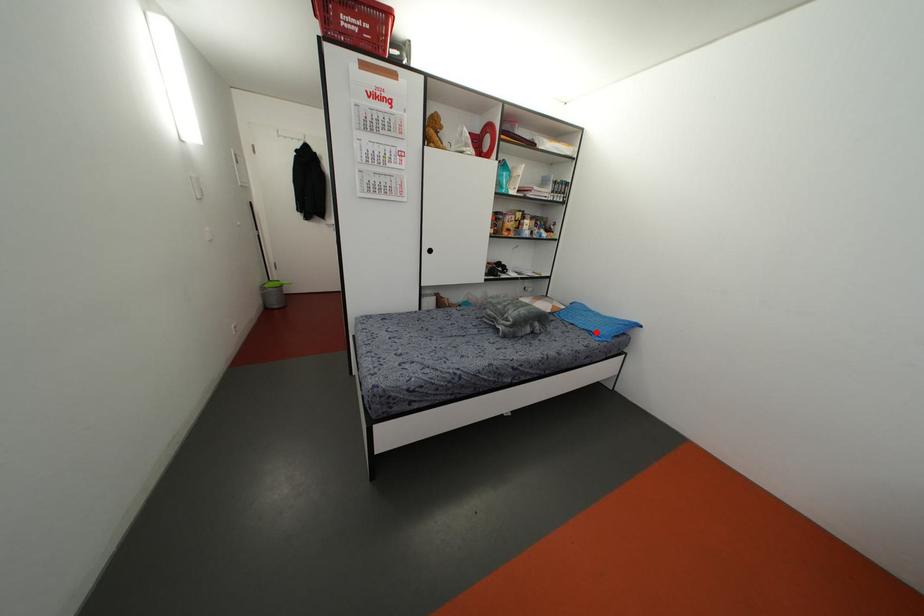
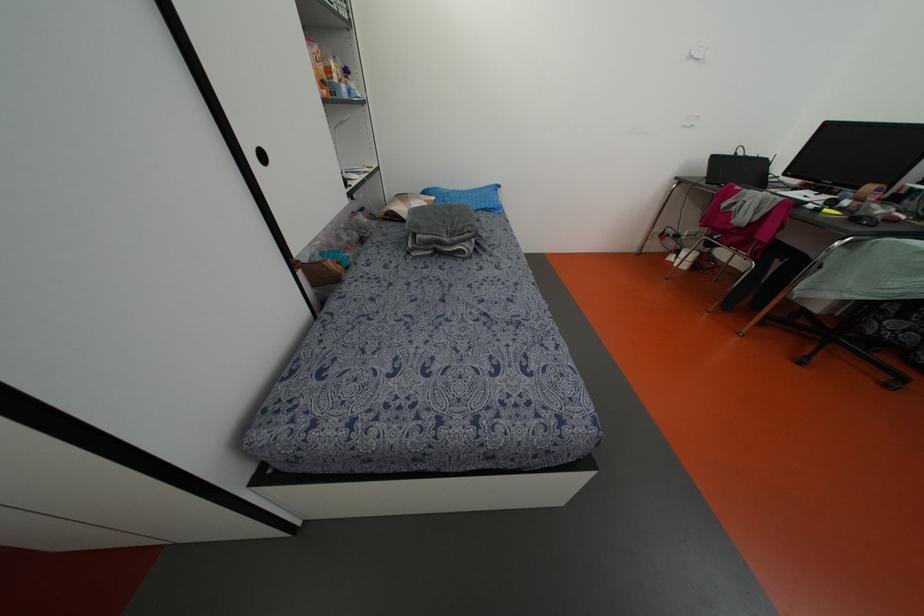
In the second image, find the point that corresponds to the highlighted location in the first image.

(492, 206)